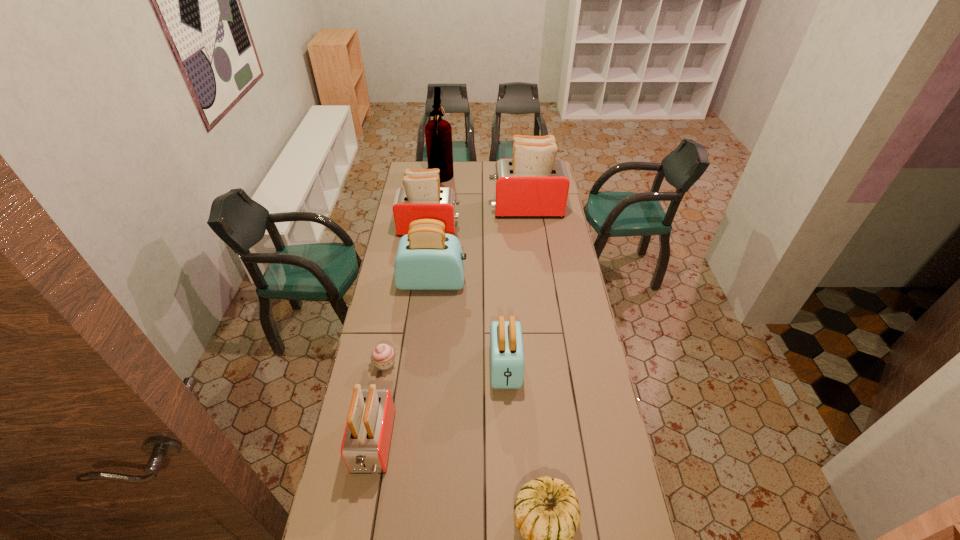
Locate an element on the screen. This screenshot has height=540, width=960. red fire extinguisher is located at coordinates (438, 133).

Where is `fire extinguisher`? fire extinguisher is located at coordinates (438, 133).

Where is `the seventh shortest object`? Image resolution: width=960 pixels, height=540 pixels. the seventh shortest object is located at coordinates (533, 184).

Locate an element on the screen. the rightmost red toaster is located at coordinates (533, 184).

You are a GUI agent. You are given a task and a screenshot of the screen. Output one action in this format:
    pyautogui.click(x=<x>, y=<y>)
    Task: Click on the third farthest toaster
    The height and width of the screenshot is (540, 960).
    Given the screenshot: What is the action you would take?
    pos(427,259)

In order to click on the farther light toaster in this screenshot , I will do `click(427, 259)`.

Image resolution: width=960 pixels, height=540 pixels. What are the coordinates of `the second biggest red toaster` in the screenshot? It's located at (421, 197).

Image resolution: width=960 pixels, height=540 pixels. In order to click on the nearer light toaster in this screenshot , I will do `click(506, 344)`.

Locate an element on the screen. the right light toaster is located at coordinates (506, 344).

Locate an element on the screen. The height and width of the screenshot is (540, 960). the seventh farthest object is located at coordinates (365, 447).